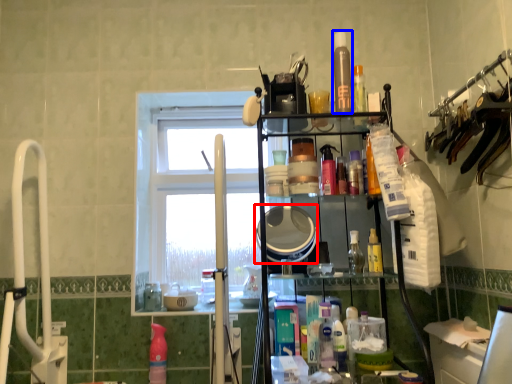
Question: Which object appears farthest to the camera in this image, mirror (highlighted by a red box) or toiletry (highlighted by a blue box)?

Choices:
 (A) mirror
 (B) toiletry

Answer: (B)